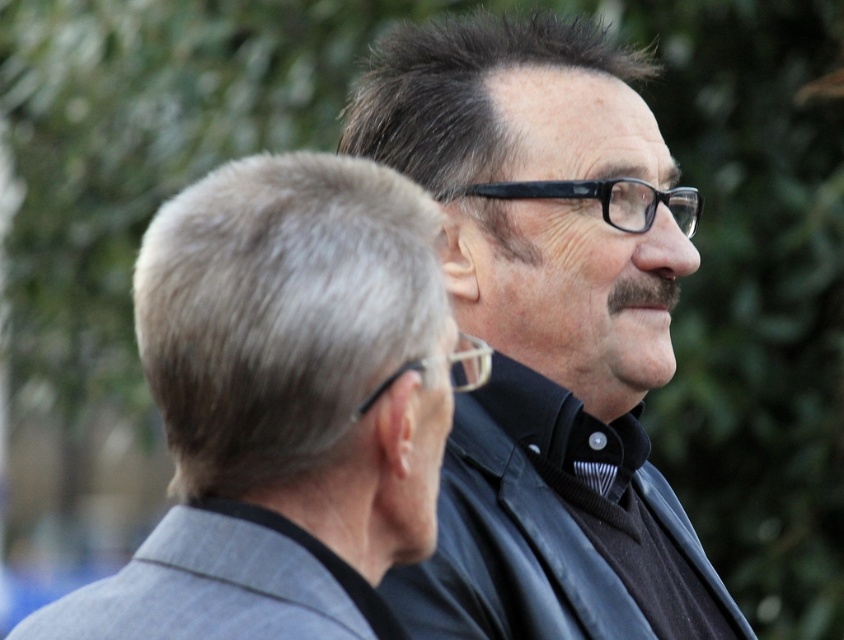
Is point (556, 285) positioned behind point (295, 520)?

Yes, point (556, 285) is farther from viewer.

Does black matte shirt at center appear on the left side of gray pinstripe suit at center?

No, black matte shirt at center is not to the left of gray pinstripe suit at center.

The image size is (844, 640). What do you see at coordinates (545, 333) in the screenshot? I see `black matte shirt at center` at bounding box center [545, 333].

The width and height of the screenshot is (844, 640). I want to click on black matte shirt at center, so click(545, 333).